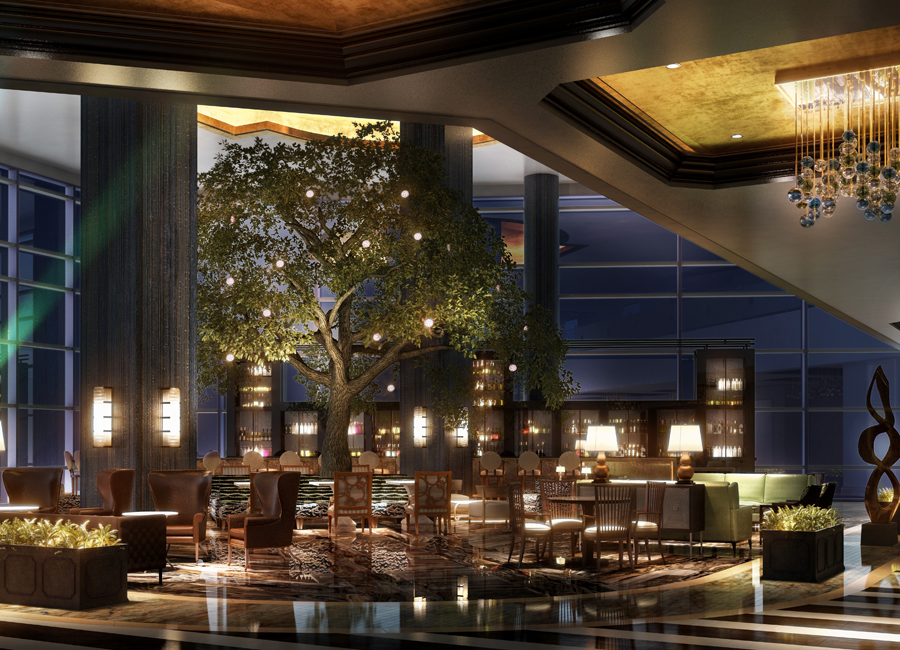
You are a GUI agent. You are given a task and a screenshot of the screen. Output one action in this format:
    pyautogui.click(x=<x>, y=<y>)
    Task: Click on the leather chairs
    Image resolution: width=900 pixels, height=650 pixels.
    Given the screenshot: What is the action you would take?
    pyautogui.click(x=257, y=525), pyautogui.click(x=190, y=491), pyautogui.click(x=120, y=489), pyautogui.click(x=38, y=481)